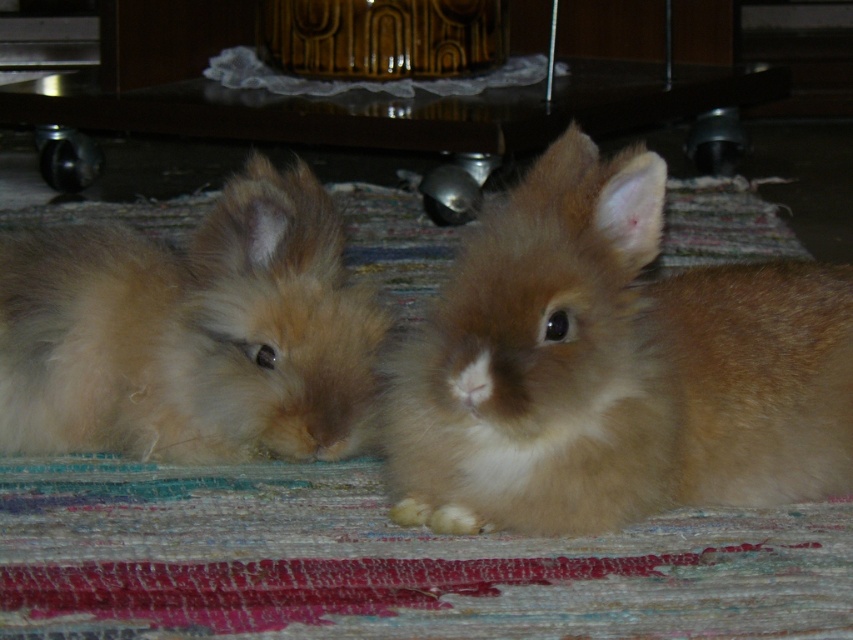
Question: Can you confirm if fuzzy brown rabbit at center is positioned below fuzzy brown rabbit at left?

Choices:
 (A) yes
 (B) no

Answer: (A)

Question: Is fuzzy brown rabbit at center positioned in front of fuzzy brown rabbit at left?

Choices:
 (A) no
 (B) yes

Answer: (B)

Question: Which point appears closest to the camera in this image?

Choices:
 (A) (625, 221)
 (B) (134, 301)

Answer: (A)

Question: Which point is farther from the camera taking this photo?

Choices:
 (A) (305, 275)
 (B) (613, 502)

Answer: (A)

Question: Which of the following is the closest to the observer?

Choices:
 (A) (525, 371)
 (B) (344, 371)

Answer: (A)

Question: Can you confirm if fuzzy brown rabbit at center is positioned to the right of fuzzy brown rabbit at left?

Choices:
 (A) yes
 (B) no

Answer: (A)